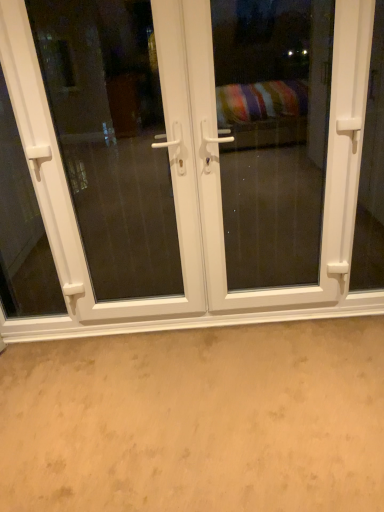
Question: Is white plastic door at center facing away from white plastic screen door at center, positioned as the 2th screen door in right-to-left order?

Choices:
 (A) no
 (B) yes

Answer: (B)

Question: Is white plastic door at center at the right side of white plastic screen door at center, acting as the first screen door starting from the left?

Choices:
 (A) yes
 (B) no

Answer: (A)

Question: Considering the relative sizes of white plastic door at center and white plastic screen door at center, positioned as the 2th screen door in right-to-left order, in the image provided, is white plastic door at center bigger than white plastic screen door at center, positioned as the 2th screen door in right-to-left order,?

Choices:
 (A) no
 (B) yes

Answer: (B)

Question: Is white plastic door at center wider than white plastic screen door at center, positioned as the 2th screen door in right-to-left order?

Choices:
 (A) yes
 (B) no

Answer: (B)

Question: From a real-world perspective, is white plastic door at center physically below white plastic screen door at center, positioned as the 2th screen door in right-to-left order?

Choices:
 (A) no
 (B) yes

Answer: (B)

Question: Is white plastic screen door at center, acting as the first screen door starting from the left, surrounded by white plastic door at center?

Choices:
 (A) yes
 (B) no

Answer: (A)

Question: Is white plastic screen door at center, which appears as the first screen door when viewed from the right, placed right next to white plastic door at center?

Choices:
 (A) no
 (B) yes

Answer: (A)

Question: Considering the relative positions of white plastic screen door at center, arranged as the second screen door when viewed from the left, and white plastic door at center in the image provided, is white plastic screen door at center, arranged as the second screen door when viewed from the left, to the left of white plastic door at center from the viewer's perspective?

Choices:
 (A) yes
 (B) no

Answer: (B)

Question: From a real-world perspective, is white plastic screen door at center, arranged as the second screen door when viewed from the left, on white plastic door at center?

Choices:
 (A) no
 (B) yes

Answer: (B)

Question: Is white plastic screen door at center, which appears as the first screen door when viewed from the right, bigger than white plastic door at center?

Choices:
 (A) no
 (B) yes

Answer: (A)

Question: Is white plastic door at center surrounded by white plastic screen door at center, arranged as the second screen door when viewed from the left?

Choices:
 (A) yes
 (B) no

Answer: (B)

Question: Does white plastic screen door at center, arranged as the second screen door when viewed from the left, have a lesser width compared to white plastic door at center?

Choices:
 (A) yes
 (B) no

Answer: (B)

Question: Considering the relative sizes of beige carpet at lower center and white plastic screen door at center, which appears as the first screen door when viewed from the right, in the image provided, is beige carpet at lower center smaller than white plastic screen door at center, which appears as the first screen door when viewed from the right,?

Choices:
 (A) no
 (B) yes

Answer: (A)